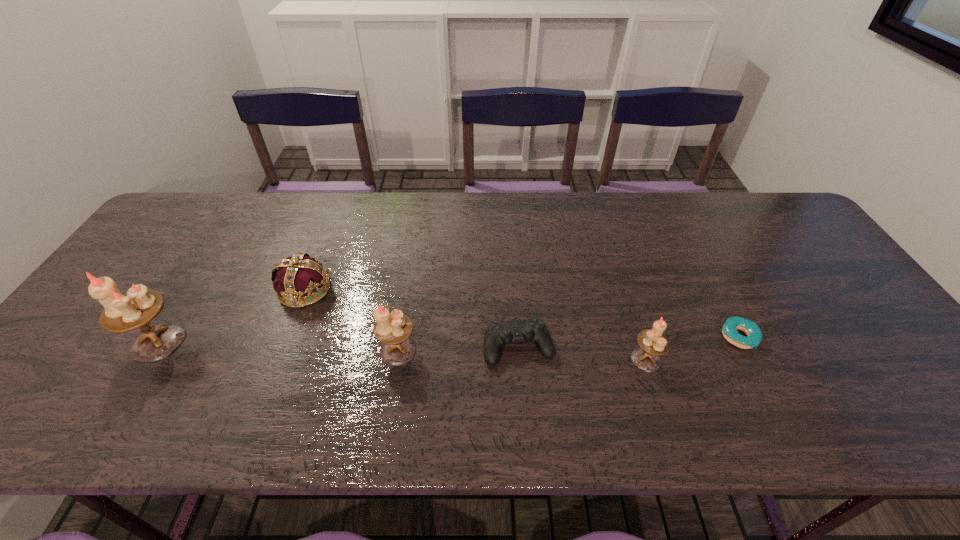
In the current image, all candle holders are evenly spaced. To maintain this equal spacing, where should an additional candle holder be placed on the right? Please point out a free spot. Please provide its 2D coordinates. Your answer should be formatted as a tuple, i.e. [(x, y)], where the tuple contains the x and y coordinates of a point satisfying the conditions above.

[(902, 369)]